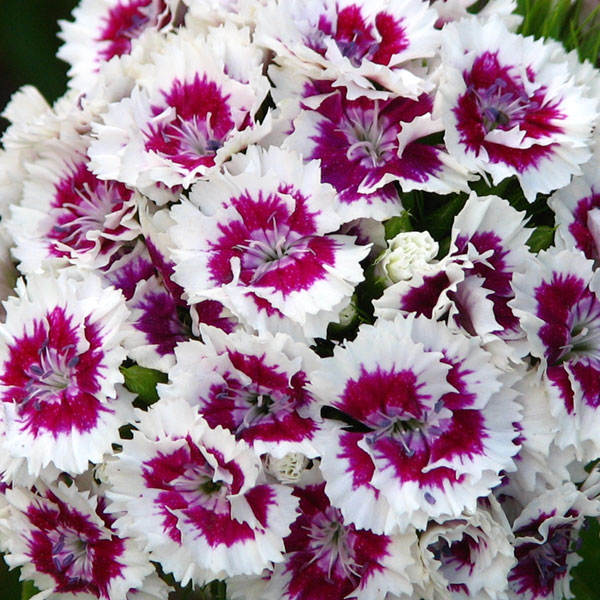
In order to click on light purple pedastals in this screenshot , I will do `click(265, 235)`.